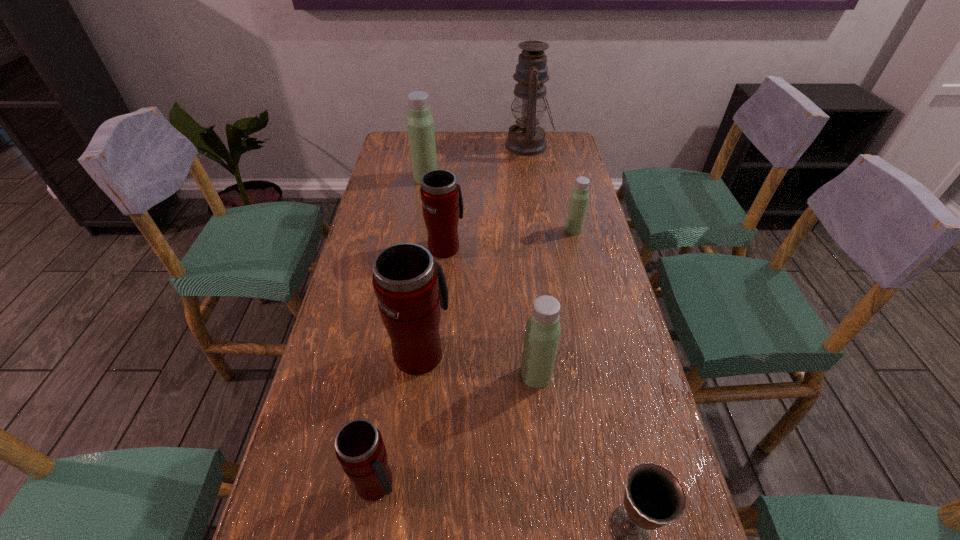
You are a GUI agent. You are given a task and a screenshot of the screen. Output one action in this format:
    pyautogui.click(x=<x>, y=<y>)
    Task: Click on the smallest light thermos bottle
    Image resolution: width=960 pixels, height=540 pixels.
    Given the screenshot: What is the action you would take?
    pyautogui.click(x=579, y=197)

Locate an element on the screen. This screenshot has width=960, height=540. the second farthest light thermos bottle is located at coordinates (579, 197).

Where is `vacant space situated on the left of the tallest object`? This screenshot has width=960, height=540. vacant space situated on the left of the tallest object is located at coordinates (432, 145).

Where is `free spot located 0.380m on the right of the leftmost light thermos bottle`? This screenshot has height=540, width=960. free spot located 0.380m on the right of the leftmost light thermos bottle is located at coordinates (544, 178).

Locate an element on the screen. The width and height of the screenshot is (960, 540). vacant region located on the side with the handle of the second nearest red thermos bottle is located at coordinates (433, 248).

Image resolution: width=960 pixels, height=540 pixels. Find the location of `free space located 0.380m on the side with the handle of the second nearest red thermos bottle`. free space located 0.380m on the side with the handle of the second nearest red thermos bottle is located at coordinates (435, 231).

The height and width of the screenshot is (540, 960). Identify the location of vacant area located 0.320m on the side with the handle of the second nearest red thermos bottle. (433, 244).

Image resolution: width=960 pixels, height=540 pixels. I want to click on free spot located on the side with the handle of the farthest red thermos bottle, so click(x=449, y=197).

Find the location of `vacant area situated on the side with the handle of the farthest red thermos bottle`. vacant area situated on the side with the handle of the farthest red thermos bottle is located at coordinates point(448,217).

Find the location of `vacant space situated 0.390m on the side with the handle of the farthest red thermos bottle`. vacant space situated 0.390m on the side with the handle of the farthest red thermos bottle is located at coordinates point(452,167).